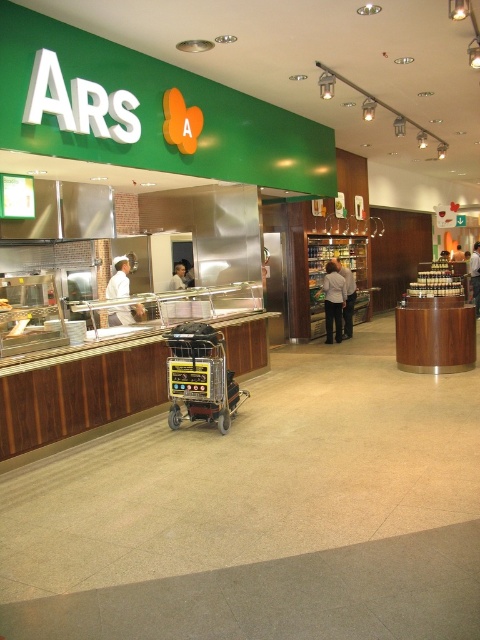
From the picture: You are a customer in the food court and see both the white uniform at center and the white matte person at center. Which one is larger in size?

The white uniform at center is bigger than the white matte person at center.

You are standing in the food court and see two people at the counter. One is labeled as the white fabric person at center and the other as the white matte person at center. Which one is positioned to the right when viewed from your perspective?

The white fabric person at center is positioned to the right of the white matte person at center.